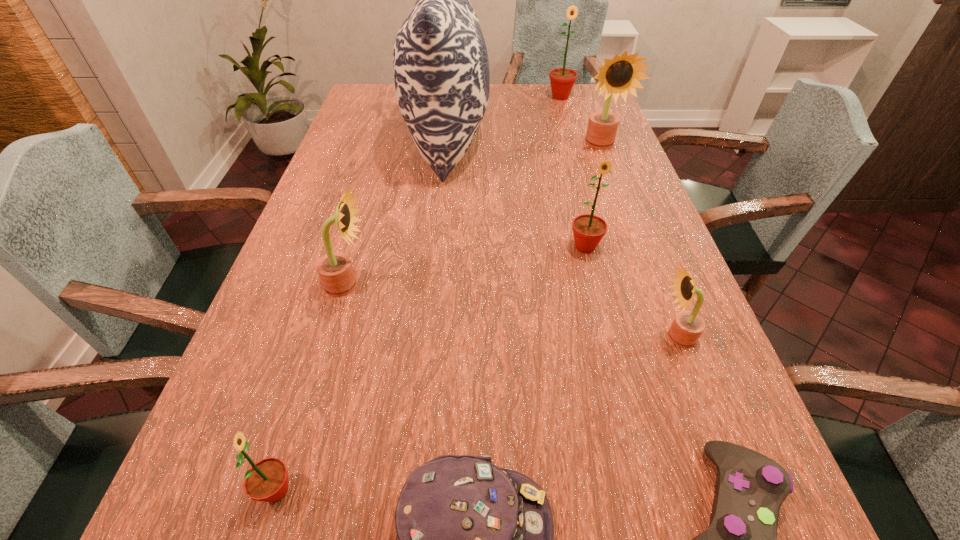
In order to click on vacant space located 0.070m on the face of the nearest yellow sunflower in this screenshot , I will do `click(620, 337)`.

The image size is (960, 540). Find the location of `vacant space located on the face of the nearest yellow sunflower`. vacant space located on the face of the nearest yellow sunflower is located at coordinates (496, 337).

This screenshot has width=960, height=540. In order to click on free region located 0.340m on the face of the nearest green sunflower in this screenshot , I will do `click(524, 491)`.

You are a GUI agent. You are given a task and a screenshot of the screen. Output one action in this format:
    pyautogui.click(x=<x>, y=<y>)
    Task: Click on the cushion that is at the far edge
    This screenshot has width=960, height=540.
    Given the screenshot: What is the action you would take?
    pyautogui.click(x=441, y=72)

The height and width of the screenshot is (540, 960). I want to click on sunflower that is at the far edge, so click(562, 80).

The width and height of the screenshot is (960, 540). I want to click on object at the far right corner, so click(x=562, y=80).

You are a GUI agent. You are given a task and a screenshot of the screen. Output one action in this format:
    pyautogui.click(x=<x>, y=<y>)
    Task: Click on the vacant space at the far edge of the desktop
    The width and height of the screenshot is (960, 540).
    Given the screenshot: What is the action you would take?
    pyautogui.click(x=550, y=109)

Locate an element on the screen. This screenshot has height=540, width=960. free spot at the left edge of the desktop is located at coordinates (215, 510).

You are a GUI agent. You are given a task and a screenshot of the screen. Output one action in this format:
    pyautogui.click(x=<x>, y=<y>)
    Task: Click on the vacant space at the right edge of the desktop
    
    Given the screenshot: What is the action you would take?
    pyautogui.click(x=619, y=170)

At what (x,y) coordinates should I click in order to perform the action: click on free region at the far left corner. Please return your answer as a coordinate pair (x, y). Looking at the image, I should click on (367, 96).